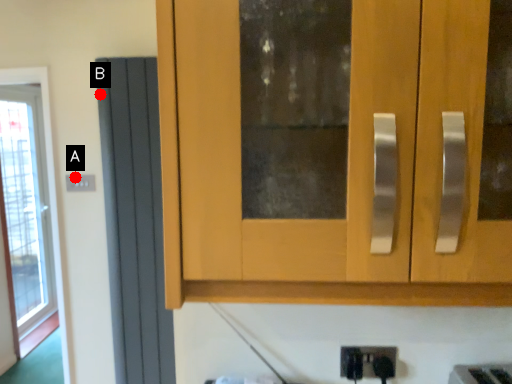
Question: Two points are circled on the image, labeled by A and B beside each circle. Which point is farther to the camera?

Choices:
 (A) A is further
 (B) B is further

Answer: (A)